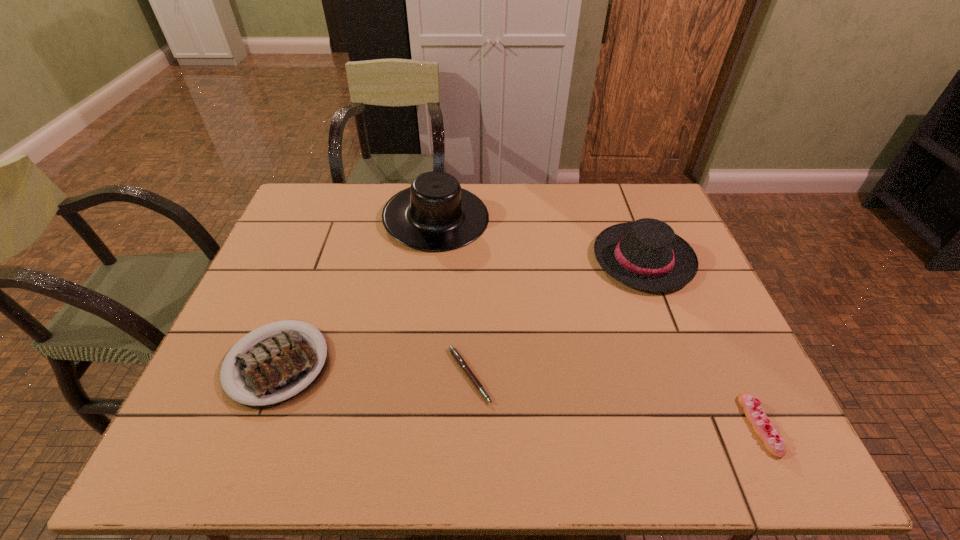
The image size is (960, 540). I want to click on free space located on the back of the eclair, so click(x=697, y=293).

Image resolution: width=960 pixels, height=540 pixels. I want to click on vacant space located 0.200m at the nib of the pen, so click(x=579, y=375).

Locate an element on the screen. This screenshot has height=540, width=960. object located in the far edge section of the desktop is located at coordinates (435, 214).

At what (x,y) coordinates should I click in order to perform the action: click on object that is at the near edge. Please return your answer as a coordinate pair (x, y). This screenshot has width=960, height=540. Looking at the image, I should click on (755, 414).

Locate an element on the screen. object present at the left edge is located at coordinates [278, 365].

Locate an element on the screen. The width and height of the screenshot is (960, 540). dress hat located in the right edge section of the desktop is located at coordinates click(646, 254).

Where is `eclair at the right edge`? eclair at the right edge is located at coordinates (755, 414).

This screenshot has height=540, width=960. In order to click on object present at the near right corner in this screenshot , I will do `click(755, 414)`.

At what (x,y) coordinates should I click in order to perform the action: click on vacant space at the far edge. Please return your answer as a coordinate pair (x, y). Looking at the image, I should click on (584, 190).

Image resolution: width=960 pixels, height=540 pixels. I want to click on free location at the near edge of the desktop, so click(389, 427).